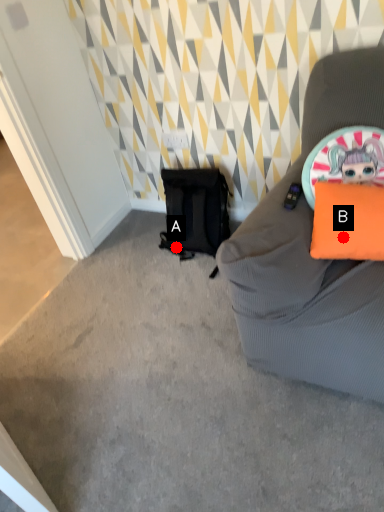
Question: Two points are circled on the image, labeled by A and B beside each circle. Which point is farther from the camera taking this photo?

Choices:
 (A) A is further
 (B) B is further

Answer: (A)